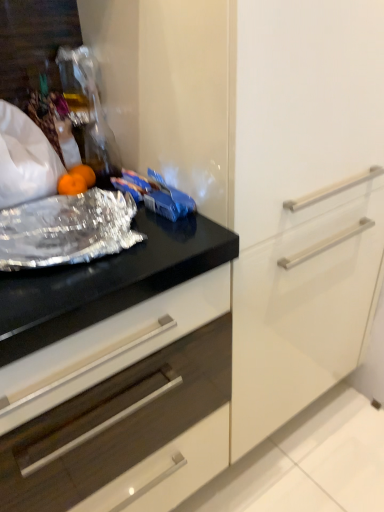
What do you see at coordinates (67, 230) in the screenshot? The image size is (384, 512). I see `shiny metallic foil at left` at bounding box center [67, 230].

Identify the location of shiny metallic foil at left. The height and width of the screenshot is (512, 384). (67, 230).

Describe the element at coordinates (114, 360) in the screenshot. I see `black glossy countertop at center` at that location.

Locate an element on the screen. black glossy countertop at center is located at coordinates (114, 360).

Identify the location of shiny metallic foil at left. (67, 230).

Between shiny metallic foil at left and black glossy countertop at center, which one appears on the right side from the viewer's perspective?

shiny metallic foil at left is more to the right.

Which is behind, shiny metallic foil at left or black glossy countertop at center?

shiny metallic foil at left is more distant.

Looking at this image, which is closer, (43,266) or (123,400)?

Point (43,266) appears to be closer to the viewer than point (123,400).

From the image's perspective, who appears lower, shiny metallic foil at left or black glossy countertop at center?

black glossy countertop at center.

From a real-world perspective, is shiny metallic foil at left positioned above or below black glossy countertop at center?

Clearly, from a real-world perspective, shiny metallic foil at left is above black glossy countertop at center.

Can you confirm if shiny metallic foil at left is thinner than black glossy countertop at center?

Indeed, shiny metallic foil at left has a lesser width compared to black glossy countertop at center.

From the picture: Considering the sizes of shiny metallic foil at left and black glossy countertop at center in the image, is shiny metallic foil at left taller or shorter than black glossy countertop at center?

In the image, shiny metallic foil at left appears to be shorter than black glossy countertop at center.

Can you confirm if shiny metallic foil at left is bigger than black glossy countertop at center?

Actually, shiny metallic foil at left might be smaller than black glossy countertop at center.

Is shiny metallic foil at left inside or outside of black glossy countertop at center?

Answer: shiny metallic foil at left is not enclosed by black glossy countertop at center.

Are shiny metallic foil at left and black glossy countertop at center far apart?

shiny metallic foil at left is near black glossy countertop at center, not far away.

Is black glossy countertop at center at the back of shiny metallic foil at left?

No, shiny metallic foil at left is not facing away from black glossy countertop at center.

What's the angular difference between shiny metallic foil at left and black glossy countertop at center's facing directions?

The angle between the facing direction of shiny metallic foil at left and the facing direction of black glossy countertop at center is 0.000787 degrees.

Find the location of a particular element. countertop in front of the shiny metallic foil at left is located at coordinates (114, 360).

Consider the image. Is black glossy countertop at center to the left of shiny metallic foil at left from the viewer's perspective?

Indeed, black glossy countertop at center is positioned on the left side of shiny metallic foil at left.

From the picture: Is the position of black glossy countertop at center less distant than that of shiny metallic foil at left?

That is True.

Which is behind, point (161, 376) or point (65, 233)?

The point (161, 376) is farther from the camera.

From the image's perspective, is black glossy countertop at center on top of shiny metallic foil at left?

No.

From a real-world perspective, between black glossy countertop at center and shiny metallic foil at left, who is vertically lower?

black glossy countertop at center.

Is black glossy countertop at center wider or thinner than shiny metallic foil at left?

In the image, black glossy countertop at center appears to be wider than shiny metallic foil at left.

Between black glossy countertop at center and shiny metallic foil at left, which one has more height?

black glossy countertop at center is taller.

Can you confirm if black glossy countertop at center is bigger than shiny metallic foil at left?

Yes, black glossy countertop at center is bigger than shiny metallic foil at left.

Is shiny metallic foil at left located within black glossy countertop at center?

No, shiny metallic foil at left is not surrounded by black glossy countertop at center.

Would you say black glossy countertop at center is a long distance from shiny metallic foil at left?

black glossy countertop at center is actually quite close to shiny metallic foil at left.

Does black glossy countertop at center turn towards shiny metallic foil at left?

No, black glossy countertop at center is not aimed at shiny metallic foil at left.

Identify the location of countertop below the shiny metallic foil at left (from the image's perspective). Image resolution: width=384 pixels, height=512 pixels. (114, 360).

Find the location of a particular element. This screenshot has width=384, height=512. countertop below the shiny metallic foil at left (from the image's perspective) is located at coordinates (114, 360).

At what (x,y) coordinates should I click in order to perform the action: click on material positioned vertically above the black glossy countertop at center (from a real-world perspective). Please return your answer as a coordinate pair (x, y). The image size is (384, 512). Looking at the image, I should click on (67, 230).